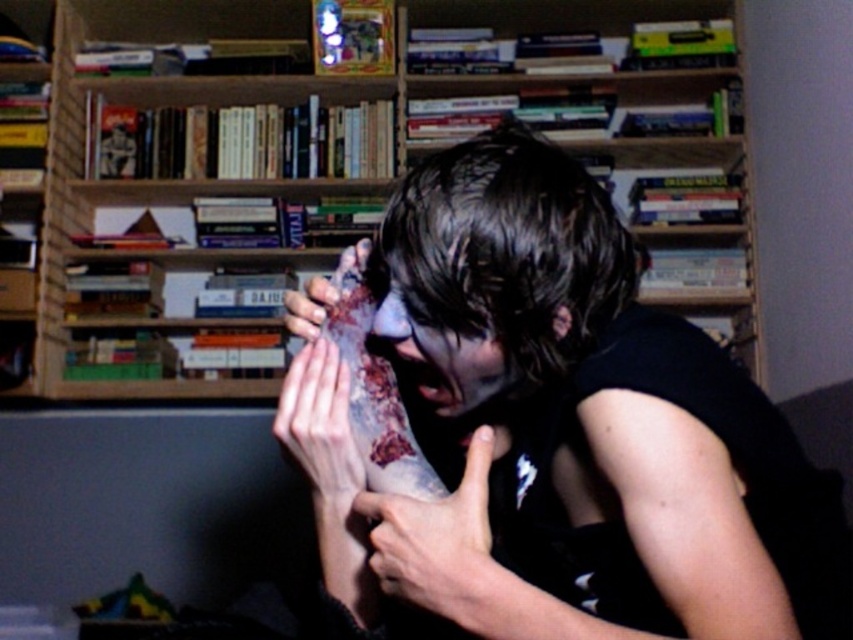
Question: Is dark skin tattooed arm at center to the right of smooth skin hand at center from the viewer's perspective?

Choices:
 (A) no
 (B) yes

Answer: (B)

Question: Which object is positioned farthest from the dark skin tattooed arm at center?

Choices:
 (A) dark matte skin at center
 (B) wooden bookshelf at upper center
 (C) smooth skin hand at center

Answer: (B)

Question: Does dark matte skin at center appear on the right side of wooden bookshelf at upper center?

Choices:
 (A) yes
 (B) no

Answer: (A)

Question: Does dark matte skin at center appear over wooden bookshelf at upper center?

Choices:
 (A) yes
 (B) no

Answer: (B)

Question: Which of these objects is positioned closest to the wooden bookshelf at upper center?

Choices:
 (A) dark skin tattooed arm at center
 (B) dark matte skin at center

Answer: (B)

Question: Among these points, which one is nearest to the camera?

Choices:
 (A) (68, 148)
 (B) (383, 554)
 (C) (351, 476)
 (D) (666, 604)

Answer: (B)